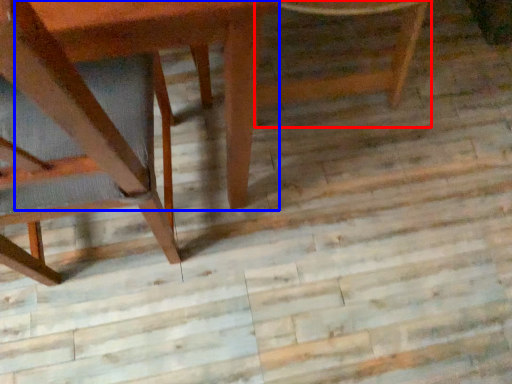
Question: Among these objects, which one is nearest to the camera, chair (highlighted by a red box) or round table (highlighted by a blue box)?

Choices:
 (A) chair
 (B) round table

Answer: (B)